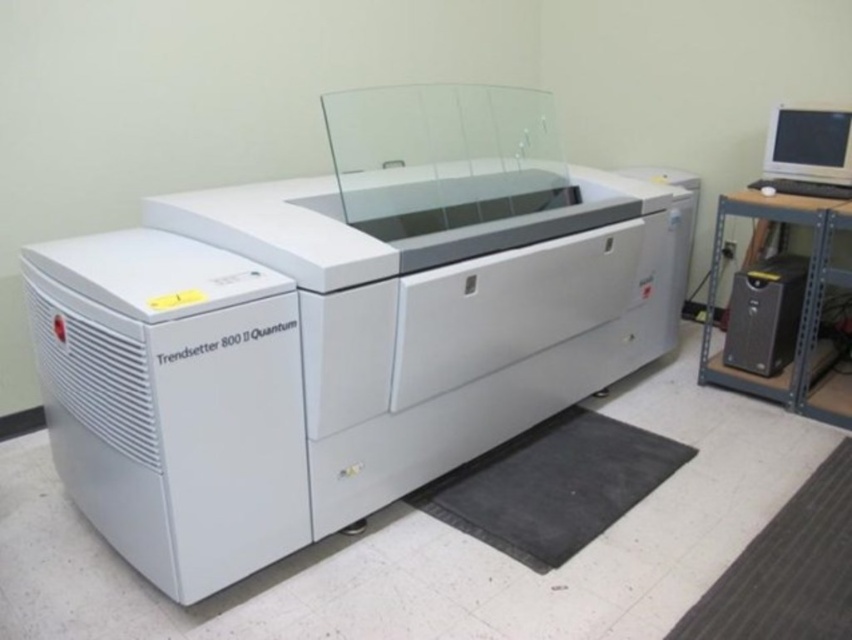
Can you confirm if black rubber mat at lower center is shorter than matte gray monitor at upper right?

Yes.

Is black rubber mat at lower center positioned before matte gray monitor at upper right?

Yes, it is in front of matte gray monitor at upper right.

This screenshot has height=640, width=852. What do you see at coordinates (551, 484) in the screenshot?
I see `black rubber mat at lower center` at bounding box center [551, 484].

Find the location of a particular element. black rubber mat at lower center is located at coordinates (551, 484).

The image size is (852, 640). What do you see at coordinates (343, 326) in the screenshot?
I see `white glossy printer at center` at bounding box center [343, 326].

Can you confirm if white glossy printer at center is thinner than black plastic computer tower at right?

No, white glossy printer at center is not thinner than black plastic computer tower at right.

Which is in front, point (401, 116) or point (824, 204)?

Point (824, 204)

This screenshot has width=852, height=640. I want to click on white glossy printer at center, so click(x=343, y=326).

Does black rubber mat at lower center have a lesser height compared to black plastic computer tower at right?

Indeed, black rubber mat at lower center has a lesser height compared to black plastic computer tower at right.

Is point (556, 516) positioned in front of point (845, 394)?

That is True.

You are a GUI agent. You are given a task and a screenshot of the screen. Output one action in this format:
    pyautogui.click(x=<x>, y=<y>)
    Task: Click on the black rubber mat at lower center
    
    Given the screenshot: What is the action you would take?
    pyautogui.click(x=551, y=484)